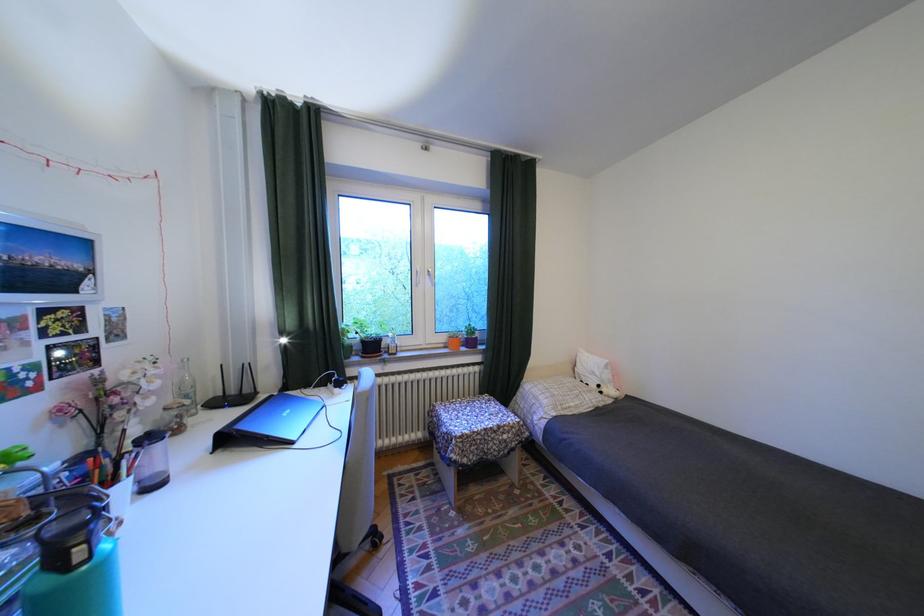
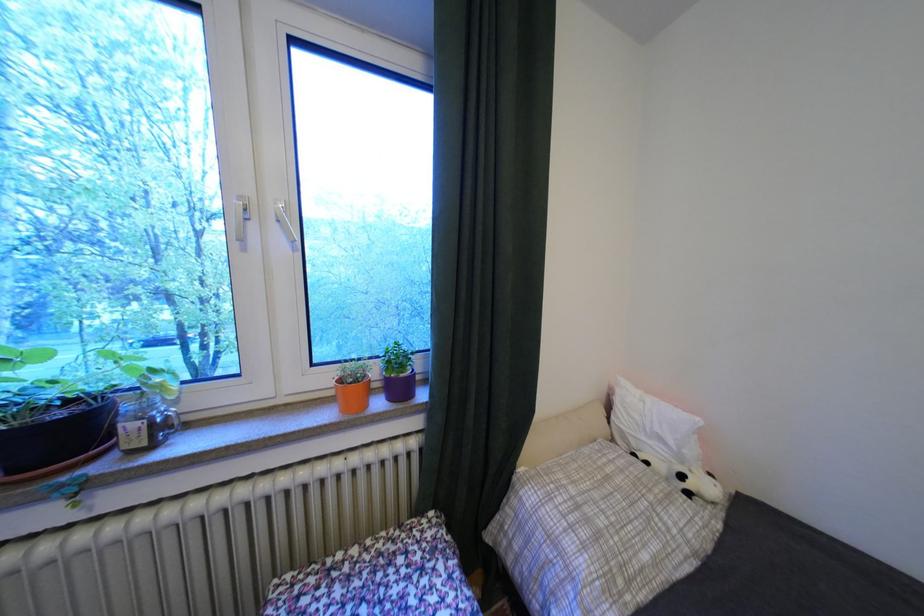
Where in the second image is the point corresponding to pixel 589 407 from the first image?

(667, 562)